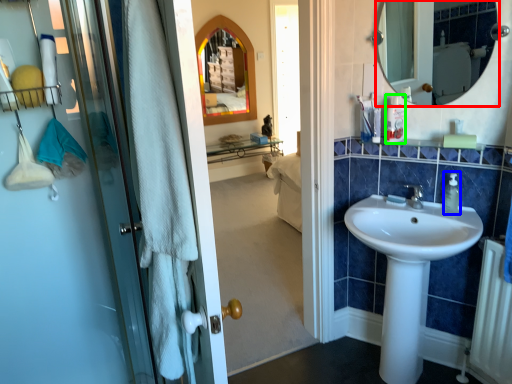
Question: Which is farther away from mirror (highlighted by a red box)? soap dispenser (highlighted by a blue box) or toiletry (highlighted by a green box)?

Choices:
 (A) soap dispenser
 (B) toiletry

Answer: (A)